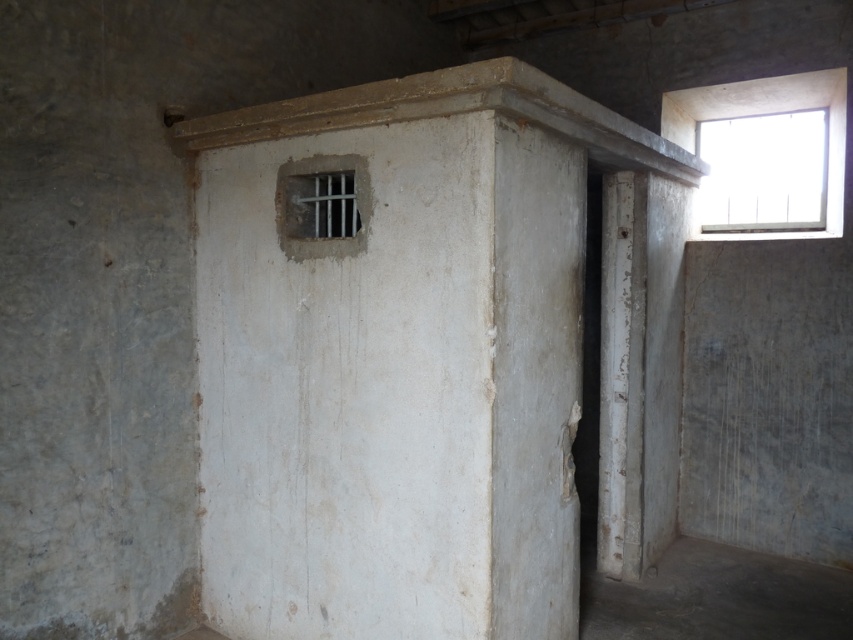
You are an inspector checking the security of this room. You notice the clear glass window at upper right and the metallic bars at center. Which object would allow you to see more of the room from outside? Please explain your reasoning based on their sizes.

The clear glass window at upper right has a larger size compared to the metallic bars at center, so it would allow you to see more of the room from outside because its larger area provides a better view.

You are a maintenance worker in the room and need to reach both the clear glass window at upper right and the camera. The ladder you have can only extend to 4 meters. Can you safely reach both objects with the ladder?

The clear glass window at upper right and camera are 4.44 meters apart from each other. Since the ladder can only extend to 4 meters, you cannot safely reach both objects as the distance between them exceeds the ladder length.

You are an inspector checking the security of this room. You notice the clear glass window at upper right and the metallic bars at center. Which object is taller?

The clear glass window at upper right is taller than the metallic bars at center.